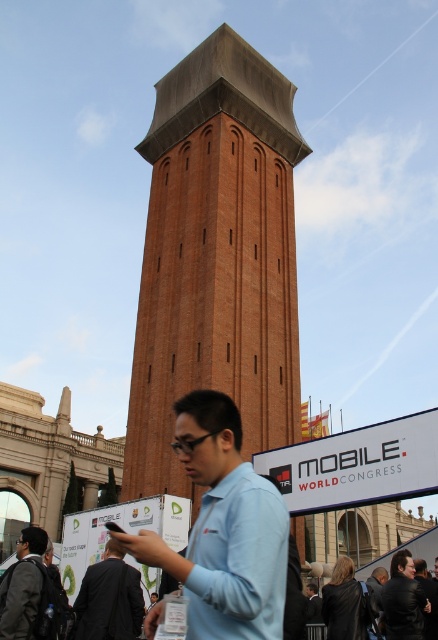
Does dark gray suit at center have a lesser width compared to matte blue shirt at center?

Indeed, dark gray suit at center has a lesser width compared to matte blue shirt at center.

Between dark gray suit at center and matte blue shirt at center, which one is positioned higher?

dark gray suit at center is higher up.

Find the location of a particular element. dark gray suit at center is located at coordinates tap(109, 600).

Who is shorter, dark gray suit at center or black leather jacket at lower right?

dark gray suit at center

Is point (123, 598) closer to camera compared to point (401, 589)?

Yes, it is in front of point (401, 589).

Between point (127, 611) and point (420, 624), which one is positioned in front?

Point (127, 611) is more forward.

Where is `dark gray suit at center`? Image resolution: width=438 pixels, height=640 pixels. dark gray suit at center is located at coordinates (109, 600).

Looking at this image, between brown brick tower at center and matte blue shirt at center, which one appears on the left side from the viewer's perspective?

matte blue shirt at center is more to the left.

Is point (272, 349) positioned behind point (20, 545)?

Yes, it is.

Locate an element on the screen. This screenshot has height=640, width=438. brown brick tower at center is located at coordinates (215, 257).

Where is `brown brick tower at center`? Image resolution: width=438 pixels, height=640 pixels. brown brick tower at center is located at coordinates (215, 257).